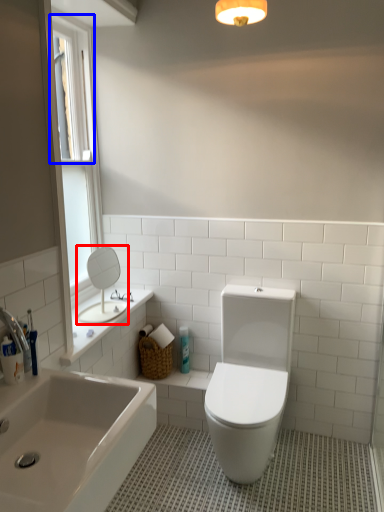
Question: Which object is further to the camera taking this photo, mirror (highlighted by a red box) or window screen (highlighted by a blue box)?

Choices:
 (A) mirror
 (B) window screen

Answer: (A)